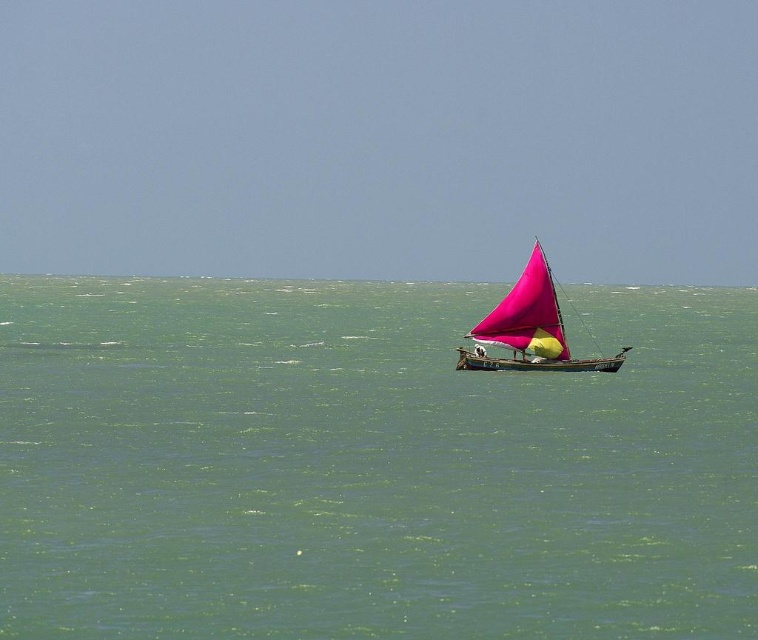
Question: Where is green water at center located in relation to pink fabric sailboat at center in the image?

Choices:
 (A) right
 (B) left

Answer: (A)

Question: Does green water at center appear under pink fabric sailboat at center?

Choices:
 (A) yes
 (B) no

Answer: (B)

Question: Which point is farther to the camera?

Choices:
 (A) pink fabric sailboat at center
 (B) green water at center

Answer: (A)

Question: Is green water at center behind pink fabric sailboat at center?

Choices:
 (A) no
 (B) yes

Answer: (A)

Question: Among these points, which one is farthest from the camera?

Choices:
 (A) (744, 401)
 (B) (542, 285)

Answer: (B)